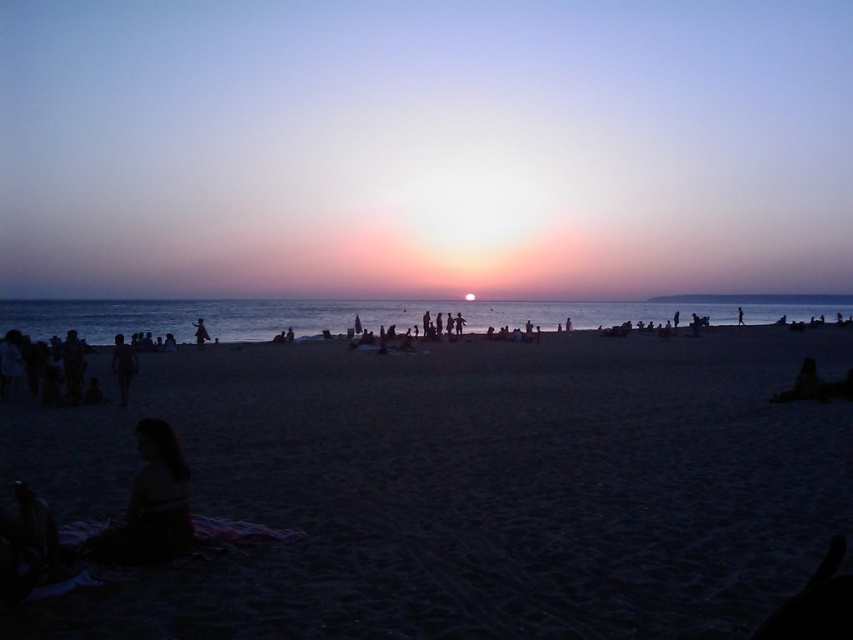
You are a photographer trying to capture the sunset at the beach. You notice two figures, a silhouette human at center and a silhouette figure at center. Which one is more to the right side?

The silhouette human at center is positioned on the right side of the silhouette figure at center, so the silhouette human at center is more to the right side.

You are standing on the beach and see the dark sand at center marked by point (465, 488). If you walk straight towards the sunset, will you move towards the water or away from it?

The dark sand at center marked by point (465, 488) is located at the center of the beach scene. Since the sunset is at the horizon where the ocean meets the sky, walking straight towards the sunset from the dark sand at center would mean moving towards the water towards the horizon.

You are a photographer trying to capture the sunset scene. You notice two figures at the center of the image, a silhouette human at center and a silhouette figure at center. Which one should you focus on if you want to capture the wider subject?

The silhouette human at center is wider than the silhouette figure at center, so focusing on the silhouette human at center will capture the wider subject.